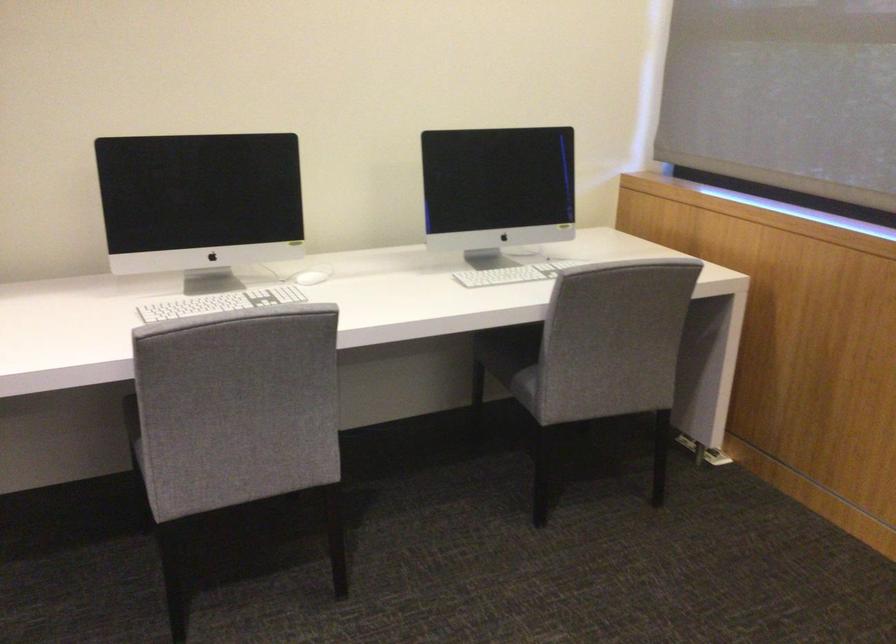
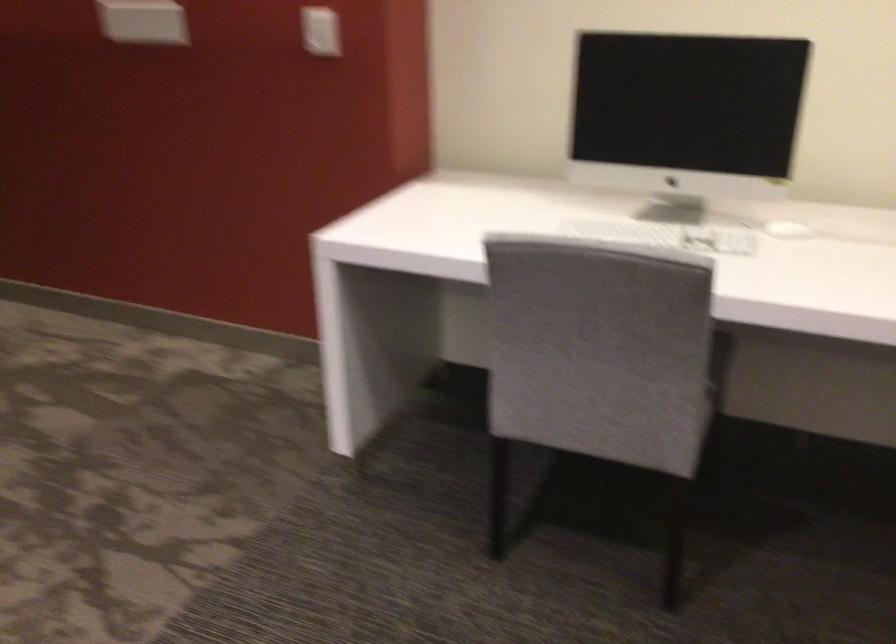
Where in the second image is the point corresponding to the point at 314,281 from the first image?

(786, 230)